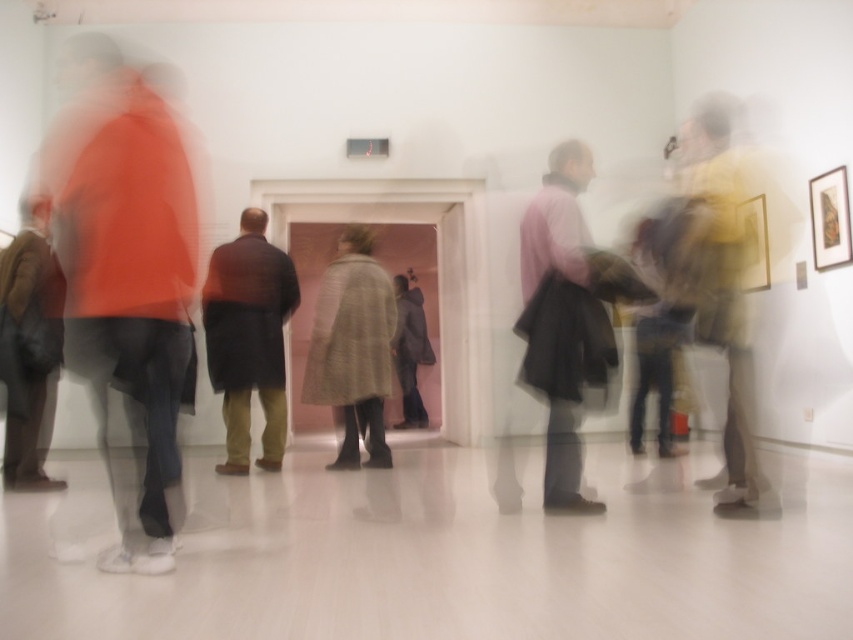
Question: Is yellow fabric jacket at right wider than light gray wool coat at center?

Choices:
 (A) yes
 (B) no

Answer: (B)

Question: Which point is closer to the camera taking this photo?

Choices:
 (A) (706, 161)
 (B) (415, 355)

Answer: (A)

Question: Among these points, which one is farthest from the camera?

Choices:
 (A) (724, 307)
 (B) (380, 333)

Answer: (B)

Question: Which object appears farthest from the camera in this image?

Choices:
 (A) light gray wool coat at center
 (B) brown wool coat at center
 (C) dark gray coat at center

Answer: (C)

Question: Does yellow fabric jacket at right have a larger size compared to brown wool coat at center?

Choices:
 (A) yes
 (B) no

Answer: (A)

Question: Does yellow fabric jacket at right have a smaller size compared to brown leather jacket at left?

Choices:
 (A) no
 (B) yes

Answer: (A)